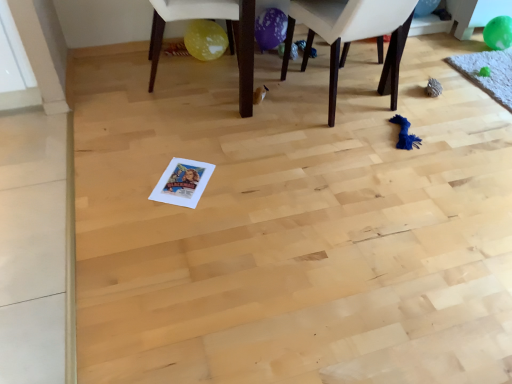
Question: From a real-world perspective, is green rubber balloon at upper right, which appears as the first balloon when viewed from the top, located higher than green rubber balloon at upper right, placed as the first balloon when sorted from right to left?

Choices:
 (A) no
 (B) yes

Answer: (B)

Question: Is green rubber balloon at upper right, placed as the second balloon when sorted from right to left, smaller than green rubber balloon at upper right, placed as the first balloon when sorted from right to left?

Choices:
 (A) yes
 (B) no

Answer: (A)

Question: Is green rubber balloon at upper right, placed as the second balloon when sorted from right to left, thinner than green rubber balloon at upper right, placed as the first balloon when sorted from right to left?

Choices:
 (A) yes
 (B) no

Answer: (A)

Question: Is green rubber balloon at upper right, which appears as the first balloon when viewed from the top, outside of green rubber balloon at upper right, the second balloon when ordered from top to bottom?

Choices:
 (A) yes
 (B) no

Answer: (A)

Question: Is green rubber balloon at upper right, which appears as the first balloon when viewed from the top, wider than green rubber balloon at upper right, which is counted as the 1th balloon, starting from the bottom?

Choices:
 (A) yes
 (B) no

Answer: (B)

Question: From the image's perspective, relative to dark brown wooden chair at center, placed as the 1th chair when sorted from right to left, is yellow matte balloon under chair at center, the 2th chair positioned from the right, above or below?

Choices:
 (A) below
 (B) above

Answer: (B)

Question: Does point (251, 107) appear closer or farther from the camera than point (391, 99)?

Choices:
 (A) farther
 (B) closer

Answer: (B)

Question: Is yellow matte balloon under chair at center, positioned as the first chair in left-to-right order, inside the boundaries of dark brown wooden chair at center, positioned as the 2th chair in left-to-right order, or outside?

Choices:
 (A) inside
 (B) outside

Answer: (B)

Question: In the image, is yellow matte balloon under chair at center, positioned as the first chair in left-to-right order, on the left side or the right side of dark brown wooden chair at center, placed as the 1th chair when sorted from right to left?

Choices:
 (A) left
 (B) right

Answer: (A)

Question: From a real-world perspective, is yellow matte balloon under chair at center, positioned as the first chair in left-to-right order, physically located above or below green rubber balloon at upper right, placed as the second balloon when sorted from right to left?

Choices:
 (A) above
 (B) below

Answer: (A)

Question: Would you say yellow matte balloon under chair at center, positioned as the first chair in left-to-right order, is inside or outside green rubber balloon at upper right, which appears as the first balloon when viewed from the top?

Choices:
 (A) outside
 (B) inside

Answer: (A)

Question: In the image, is yellow matte balloon under chair at center, positioned as the first chair in left-to-right order, on the left side or the right side of green rubber balloon at upper right, the 2th balloon when ordered from bottom to top?

Choices:
 (A) right
 (B) left

Answer: (B)

Question: Is point (238, 9) closer or farther from the camera than point (431, 11)?

Choices:
 (A) farther
 (B) closer

Answer: (B)

Question: Is dark brown wooden chair at center, positioned as the 2th chair in left-to-right order, situated inside yellow matte balloon under chair at center, positioned as the first chair in left-to-right order, or outside?

Choices:
 (A) outside
 (B) inside

Answer: (A)

Question: Based on their positions, is dark brown wooden chair at center, placed as the 1th chair when sorted from right to left, located to the left or right of yellow matte balloon under chair at center, positioned as the first chair in left-to-right order?

Choices:
 (A) right
 (B) left

Answer: (A)